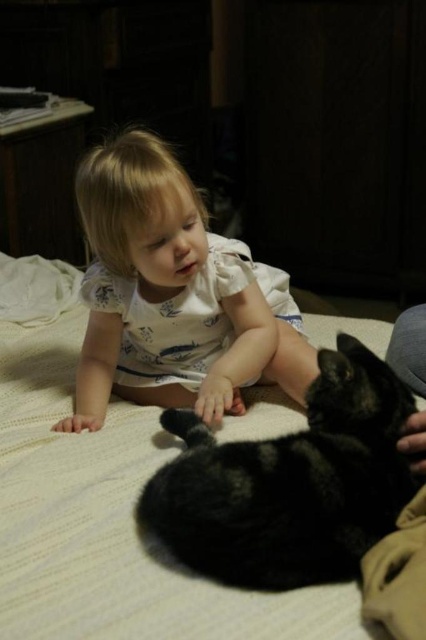
Question: Does white cotton toddler at center appear on the right side of black fur cat at lower center?

Choices:
 (A) no
 (B) yes

Answer: (A)

Question: Is white cotton toddler at center below black fur cat at lower center?

Choices:
 (A) yes
 (B) no

Answer: (B)

Question: Which of the following is the farthest from the observer?

Choices:
 (A) white cotton toddler at center
 (B) white soft bed at center
 (C) black fur cat at lower center

Answer: (A)

Question: Which point is closer to the camera taking this photo?

Choices:
 (A) (91, 202)
 (B) (331, 388)

Answer: (B)

Question: Which point appears closest to the camera in this image?

Choices:
 (A) (385, 529)
 (B) (140, 307)
 (C) (198, 614)

Answer: (C)

Question: Considering the relative positions of white soft bed at center and white cotton toddler at center in the image provided, where is white soft bed at center located with respect to white cotton toddler at center?

Choices:
 (A) left
 (B) right

Answer: (A)